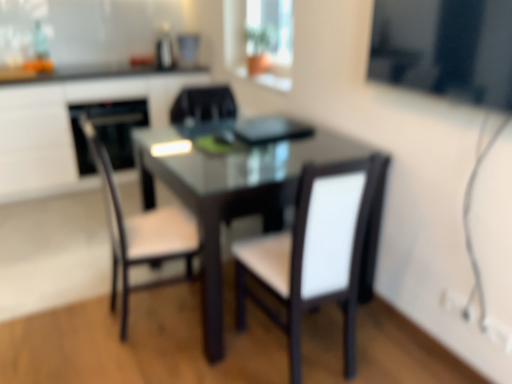
Question: Does point (134, 100) appear closer or farther from the camera than point (450, 43)?

Choices:
 (A) farther
 (B) closer

Answer: (A)

Question: From the image's perspective, relative to transparent glass window screen at upper right, marked as the first window screen in a front-to-back arrangement, is black glossy oven at left above or below?

Choices:
 (A) below
 (B) above

Answer: (B)

Question: Based on their relative distances, which object is nearer to the transparent glass window screen at upper right, which appears as the 1th window screen when ordered from the bottom?

Choices:
 (A) black glossy oven at left
 (B) matte black desk at center
 (C) matte glass window at upper center, which is counted as the 1th window screen, starting from the back
 (D) white leather chair at center, the third chair positioned from the left
 (E) black matte chair at center, the second chair in the left-to-right sequence

Answer: (D)

Question: Considering the real-world distances, which object is farthest from the black matte chair at center, the second chair in the left-to-right sequence?

Choices:
 (A) white leather chair at center, the first chair from the right
 (B) matte black desk at center
 (C) matte glass window at upper center, arranged as the 1th window screen when viewed from the top
 (D) transparent glass window screen at upper right, placed as the 1th window screen when sorted from right to left
 (E) black glossy oven at left

Answer: (D)